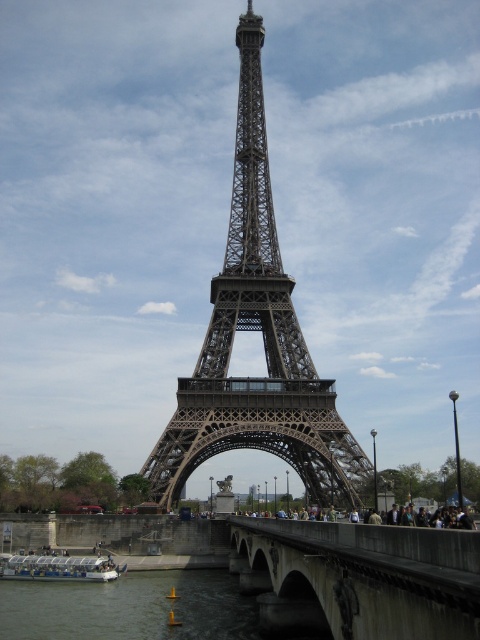
Between metallic structure at center and smooth water at lower center, which one has more height?

Standing taller between the two is metallic structure at center.

How much distance is there between metallic structure at center and smooth water at lower center?

metallic structure at center and smooth water at lower center are 133.40 feet apart from each other.

What are the coordinates of `metallic structure at center` in the screenshot? It's located at (263, 340).

Looking at this image, does smooth water at lower center appear on the right side of white plastic boat at lower left?

Indeed, smooth water at lower center is positioned on the right side of white plastic boat at lower left.

Is point (163, 588) in front of point (22, 564)?

Yes, point (163, 588) is closer to viewer.

This screenshot has height=640, width=480. Find the location of `smooth water at lower center`. smooth water at lower center is located at coordinates (130, 608).

Find the location of a particular element. The image size is (480, 640). smooth water at lower center is located at coordinates tap(130, 608).

Describe the element at coordinates (263, 340) in the screenshot. I see `metallic structure at center` at that location.

Does point (219, 323) lie behind point (90, 570)?

Yes, it is.

Does point (233, 433) come farther from viewer compared to point (1, 561)?

No, it is in front of (1, 561).

Identify the location of metallic structure at center. (263, 340).